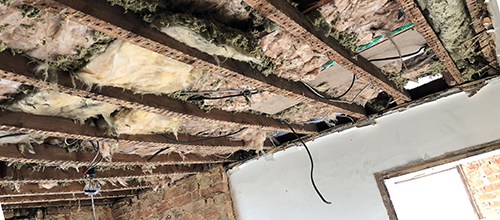
The width and height of the screenshot is (500, 220). I want to click on black cables, so (x=310, y=161), (x=342, y=96).